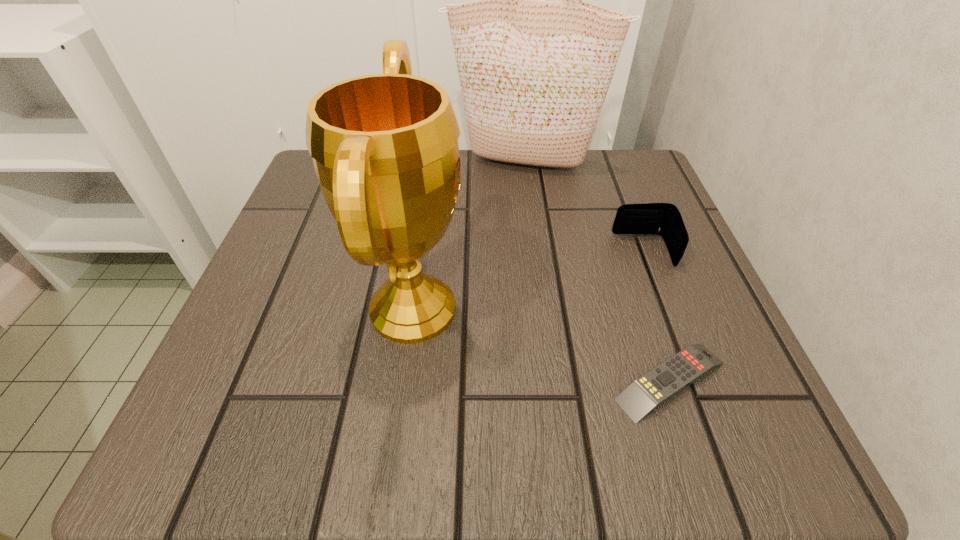
Find the location of `free spot located 0.260m on the back of the remote control`. free spot located 0.260m on the back of the remote control is located at coordinates (619, 229).

Where is `object positioned at the far edge`? The image size is (960, 540). object positioned at the far edge is located at coordinates (534, 75).

I want to click on award that is at the near edge, so click(x=385, y=150).

I want to click on remote control present at the near edge, so click(645, 394).

You are a GUI agent. You are given a task and a screenshot of the screen. Output one action in this format:
    pyautogui.click(x=<x>, y=<y>)
    Task: Click on the shopping bag present at the right edge
    
    Given the screenshot: What is the action you would take?
    pyautogui.click(x=534, y=75)

Identify the location of wallet that is at the right edge. (664, 219).

The height and width of the screenshot is (540, 960). In order to click on remote control positioned at the right edge in this screenshot , I will do `click(645, 394)`.

Identify the location of object situated at the far right corner. The image size is (960, 540). (534, 75).

The image size is (960, 540). Find the location of `object that is at the near right corner`. object that is at the near right corner is located at coordinates (645, 394).

Find the location of a particular element. The width and height of the screenshot is (960, 540). vacant space at the far edge of the desktop is located at coordinates (483, 193).